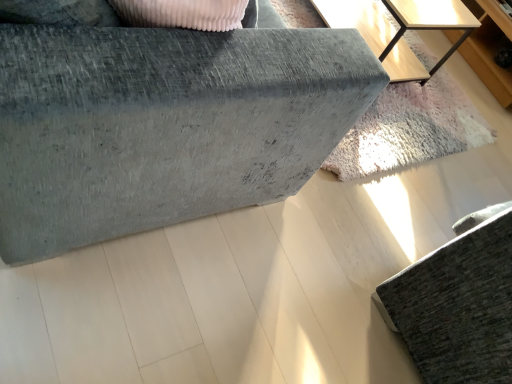
What do you see at coordinates (458, 303) in the screenshot? The image size is (512, 384). I see `textured gray sofa at lower right, the 1th furniture positioned from the right` at bounding box center [458, 303].

This screenshot has height=384, width=512. I want to click on light wood dresser at upper right, so click(x=489, y=48).

Measure the distance from textured gray sofa at lower right, the 1th furniture positioned from the right, to light wood dresser at upper right.

The distance of textured gray sofa at lower right, the 1th furniture positioned from the right, from light wood dresser at upper right is 5.66 feet.

Can you confirm if textured gray sofa at lower right, the 1th furniture positioned from the right, is wider than light wood dresser at upper right?

Correct, the width of textured gray sofa at lower right, the 1th furniture positioned from the right, exceeds that of light wood dresser at upper right.

Does textured gray sofa at lower right, acting as the 2th furniture starting from the left, touch light wood dresser at upper right?

There is a gap between textured gray sofa at lower right, acting as the 2th furniture starting from the left, and light wood dresser at upper right.

Is textured gray sofa at lower right, acting as the 2th furniture starting from the left, bigger or smaller than light wood dresser at upper right?

In the image, textured gray sofa at lower right, acting as the 2th furniture starting from the left, appears to be larger than light wood dresser at upper right.

Can you tell me how much light wood table at upper right and velvet grey sofa at upper left, the 2th furniture viewed from the right, differ in facing direction?

The angular difference between light wood table at upper right and velvet grey sofa at upper left, the 2th furniture viewed from the right, is 0.93 degrees.

Is light wood table at upper right far from velvet grey sofa at upper left, the 2th furniture viewed from the right?

Absolutely, light wood table at upper right is distant from velvet grey sofa at upper left, the 2th furniture viewed from the right.

Which of these two, light wood table at upper right or velvet grey sofa at upper left, the first furniture from the left, is thinner?

light wood table at upper right.

From a real-world perspective, is light wood table at upper right on velvet grey sofa at upper left, the first furniture from the left?

Actually, light wood table at upper right is physically below velvet grey sofa at upper left, the first furniture from the left, in the real world.

Which is more distant, [483,215] or [162,127]?

The point [483,215] is behind.

From the image's perspective, is textured gray sofa at lower right, the 1th furniture positioned from the right, positioned above or below velvet grey sofa at upper left, the 2th furniture viewed from the right?

Based on their image positions, textured gray sofa at lower right, the 1th furniture positioned from the right, is located beneath velvet grey sofa at upper left, the 2th furniture viewed from the right.

Between textured gray sofa at lower right, the 1th furniture positioned from the right, and velvet grey sofa at upper left, the 2th furniture viewed from the right, which one has larger width?

velvet grey sofa at upper left, the 2th furniture viewed from the right, is wider.

Considering the relative positions of textured gray sofa at lower right, the 1th furniture positioned from the right, and velvet grey sofa at upper left, the 2th furniture viewed from the right, in the image provided, is textured gray sofa at lower right, the 1th furniture positioned from the right, to the left of velvet grey sofa at upper left, the 2th furniture viewed from the right, from the viewer's perspective?

No, textured gray sofa at lower right, the 1th furniture positioned from the right, is not to the left of velvet grey sofa at upper left, the 2th furniture viewed from the right.

Which point is more distant from viewer, (x=389, y=290) or (x=453, y=28)?

Positioned behind is point (x=453, y=28).

From the picture: In terms of width, does textured gray sofa at lower right, the 1th furniture positioned from the right, look wider or thinner when compared to light wood table at upper right?

Clearly, textured gray sofa at lower right, the 1th furniture positioned from the right, has more width compared to light wood table at upper right.

Based on the photo, which object is closer to the camera, textured gray sofa at lower right, acting as the 2th furniture starting from the left, or light wood table at upper right?

textured gray sofa at lower right, acting as the 2th furniture starting from the left, is more forward.

Can you confirm if textured gray sofa at lower right, the 1th furniture positioned from the right, is shorter than light wood table at upper right?

No, textured gray sofa at lower right, the 1th furniture positioned from the right, is not shorter than light wood table at upper right.

You are a GUI agent. You are given a task and a screenshot of the screen. Output one action in this format:
    pyautogui.click(x=<x>, y=<y>)
    Task: Click on the dresser behind the velvet grey sofa at upper left, the first furniture from the left
    
    Given the screenshot: What is the action you would take?
    pyautogui.click(x=489, y=48)

From the image's perspective, does velvet grey sofa at upper left, the 2th furniture viewed from the right, appear lower than light wood dresser at upper right?

Yes.

Which object is closer to the camera, velvet grey sofa at upper left, the first furniture from the left, or light wood dresser at upper right?

Positioned in front is velvet grey sofa at upper left, the first furniture from the left.

From the picture: Is velvet grey sofa at upper left, the 2th furniture viewed from the right, in contact with light wood table at upper right?

There is a gap between velvet grey sofa at upper left, the 2th furniture viewed from the right, and light wood table at upper right.

Does point (49, 195) come closer to viewer compared to point (351, 16)?

Yes, point (49, 195) is in front of point (351, 16).

The height and width of the screenshot is (384, 512). I want to click on furniture that is on the left side of light wood table at upper right, so click(164, 125).

From the image's perspective, would you say velvet grey sofa at upper left, the first furniture from the left, is shown under light wood table at upper right?

Yes, from the image's perspective, velvet grey sofa at upper left, the first furniture from the left, is beneath light wood table at upper right.

In terms of size, does velvet grey sofa at upper left, the 2th furniture viewed from the right, appear bigger or smaller than textured gray sofa at lower right, acting as the 2th furniture starting from the left?

Considering their sizes, velvet grey sofa at upper left, the 2th furniture viewed from the right, takes up more space than textured gray sofa at lower right, acting as the 2th furniture starting from the left.

Considering the sizes of velvet grey sofa at upper left, the 2th furniture viewed from the right, and textured gray sofa at lower right, the 1th furniture positioned from the right, in the image, is velvet grey sofa at upper left, the 2th furniture viewed from the right, wider or thinner than textured gray sofa at lower right, the 1th furniture positioned from the right,?

Considering their sizes, velvet grey sofa at upper left, the 2th furniture viewed from the right, looks broader than textured gray sofa at lower right, the 1th furniture positioned from the right.

Who is taller, velvet grey sofa at upper left, the 2th furniture viewed from the right, or textured gray sofa at lower right, the 1th furniture positioned from the right?

Standing taller between the two is velvet grey sofa at upper left, the 2th furniture viewed from the right.

In the image, is velvet grey sofa at upper left, the first furniture from the left, positioned in front of or behind textured gray sofa at lower right, acting as the 2th furniture starting from the left?

In the image, velvet grey sofa at upper left, the first furniture from the left, appears in front of textured gray sofa at lower right, acting as the 2th furniture starting from the left.

The height and width of the screenshot is (384, 512). What are the coordinates of `dresser on the right side of textured gray sofa at lower right, acting as the 2th furniture starting from the left` in the screenshot? It's located at (489, 48).

From the light wood table at upper right, count 2nd furnitures forward and point to it. Please provide its 2D coordinates.

[(164, 125)]

Looking at the image, which one is located further to textured gray sofa at lower right, acting as the 2th furniture starting from the left, light wood dresser at upper right or velvet grey sofa at upper left, the first furniture from the left?

light wood dresser at upper right is positioned further to the anchor textured gray sofa at lower right, acting as the 2th furniture starting from the left.

Estimate the real-world distances between objects in this image. Which object is closer to light wood dresser at upper right, textured gray sofa at lower right, acting as the 2th furniture starting from the left, or velvet grey sofa at upper left, the 2th furniture viewed from the right?

textured gray sofa at lower right, acting as the 2th furniture starting from the left.

Looking at the image, which one is located closer to velvet grey sofa at upper left, the 2th furniture viewed from the right, light wood dresser at upper right or light wood table at upper right?

light wood table at upper right.

Based on their spatial positions, is velvet grey sofa at upper left, the first furniture from the left, or light wood table at upper right closer to textured gray sofa at lower right, the 1th furniture positioned from the right?

The object closer to textured gray sofa at lower right, the 1th furniture positioned from the right, is velvet grey sofa at upper left, the first furniture from the left.

Considering their positions, is textured gray sofa at lower right, acting as the 2th furniture starting from the left, positioned closer to velvet grey sofa at upper left, the first furniture from the left, than light wood table at upper right?

Among the two, textured gray sofa at lower right, acting as the 2th furniture starting from the left, is located nearer to velvet grey sofa at upper left, the first furniture from the left.

Looking at the image, which one is located further to velvet grey sofa at upper left, the first furniture from the left, light wood dresser at upper right or textured gray sofa at lower right, acting as the 2th furniture starting from the left?

light wood dresser at upper right is positioned further to the anchor velvet grey sofa at upper left, the first furniture from the left.

From the image, which object appears to be farther from textured gray sofa at lower right, the 1th furniture positioned from the right, light wood table at upper right or velvet grey sofa at upper left, the first furniture from the left?

light wood table at upper right lies further to textured gray sofa at lower right, the 1th furniture positioned from the right, than the other object.

Considering their positions, is textured gray sofa at lower right, the 1th furniture positioned from the right, positioned closer to light wood dresser at upper right than light wood table at upper right?

Among the two, light wood table at upper right is located nearer to light wood dresser at upper right.

In order to click on table located between velvet grey sofa at upper left, the 2th furniture viewed from the right, and light wood dresser at upper right in the left-right direction in this screenshot , I will do `click(399, 29)`.

Locate an element on the screen. This screenshot has width=512, height=384. table located between velvet grey sofa at upper left, the first furniture from the left, and textured gray sofa at lower right, acting as the 2th furniture starting from the left, in the left-right direction is located at coordinates (399, 29).

You are a GUI agent. You are given a task and a screenshot of the screen. Output one action in this format:
    pyautogui.click(x=<x>, y=<y>)
    Task: Click on the furniture between velvet grey sofa at upper left, the 2th furniture viewed from the right, and light wood dresser at upper right, in the horizontal direction
    
    Given the screenshot: What is the action you would take?
    pyautogui.click(x=458, y=303)

Locate an element on the screen. table located between textured gray sofa at lower right, acting as the 2th furniture starting from the left, and light wood dresser at upper right in the depth direction is located at coordinates (399, 29).